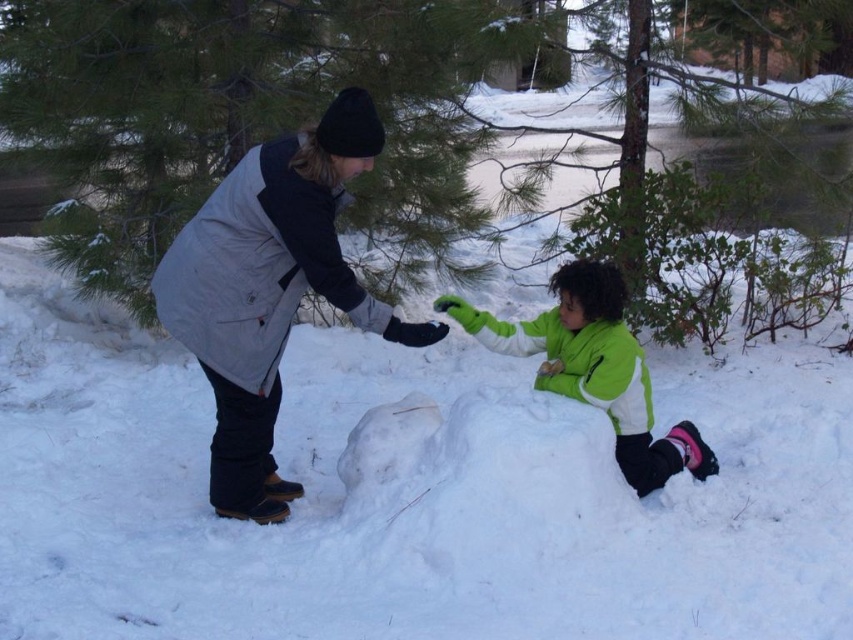
Is gray fleece jacket at center to the left of green fleece jacket at lower center from the viewer's perspective?

Yes, gray fleece jacket at center is to the left of green fleece jacket at lower center.

Where is `gray fleece jacket at center`? gray fleece jacket at center is located at coordinates (270, 289).